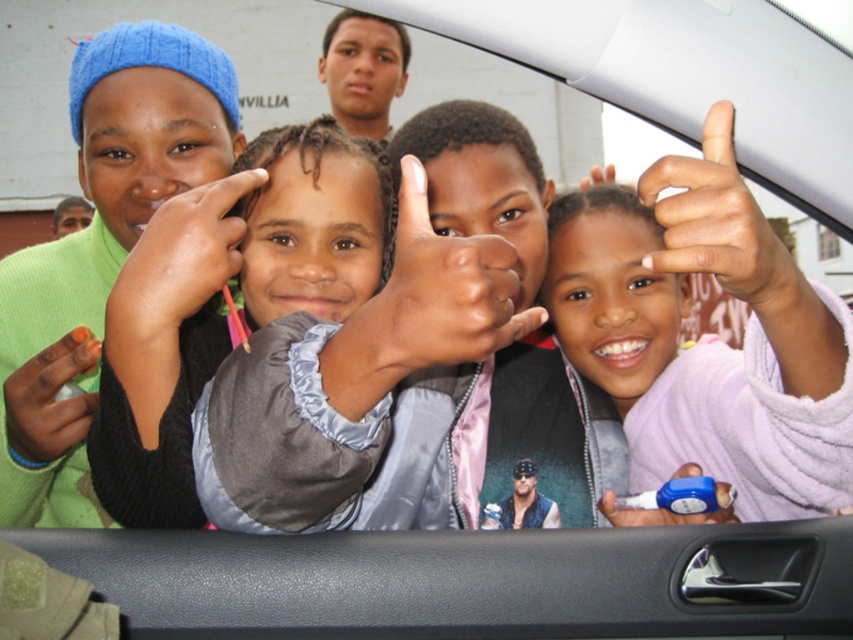
Question: Is pink fuzzy sweater at upper right bigger than orange matte nail polish at lower left?

Choices:
 (A) yes
 (B) no

Answer: (A)

Question: Estimate the real-world distances between objects in this image. Which object is closer to the matte black hand at center?

Choices:
 (A) blue knit cap at upper left
 (B) smooth skin face at upper center
 (C) white matte nail at upper center

Answer: (A)

Question: Estimate the real-world distances between objects in this image. Which object is closer to the pink fuzzy sweater at upper right?

Choices:
 (A) orange matte nail polish at lower left
 (B) white matte nail at upper center
 (C) blue knit cap at upper left
 (D) matte gray hand at center

Answer: (B)

Question: Is white matte nail at upper center below orange matte nail polish at lower left?

Choices:
 (A) no
 (B) yes

Answer: (A)

Question: Which of the following is the closest to the observer?

Choices:
 (A) orange matte nail polish at lower left
 (B) smooth skin face at upper center
 (C) blue rubber band at lower right
 (D) matte gray hand at center

Answer: (A)

Question: Can you confirm if pink fuzzy sweater at upper right is bigger than smooth skin face at upper center?

Choices:
 (A) no
 (B) yes

Answer: (A)